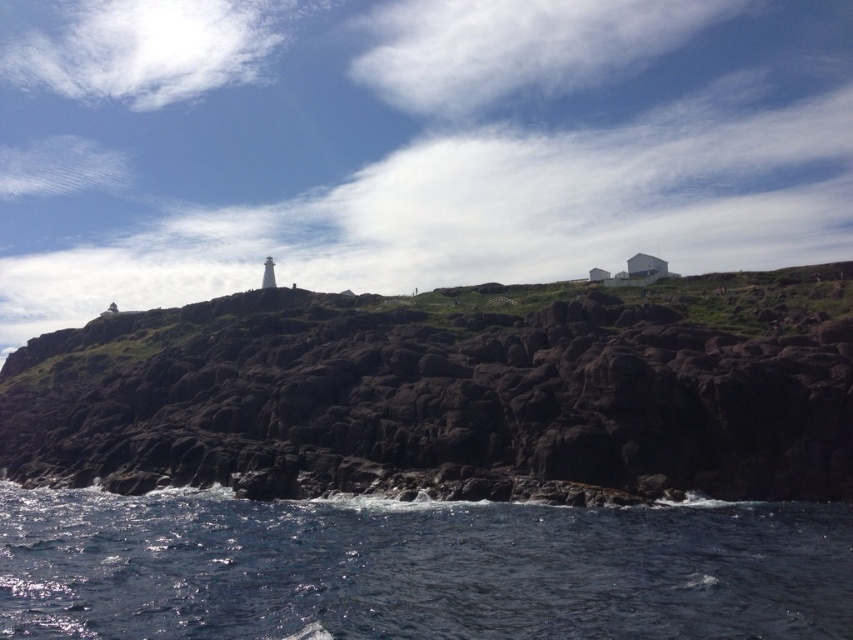
You are a geologist studying the coastal formations in this image. You need to locate the dark brown rocky cliff at center for your analysis. According to the coordinates provided, where exactly is it positioned?

The dark brown rocky cliff at center is located at point (433, 401).

Based on the photo, you are a photographer standing at the base of the dark brown rocky cliff at center. You want to capture a wide shot of the entire cliff in one frame. Based on the scene description, do you think you can step back far enough to fit the entire cliff into your camera frame without moving the camera position? Explain your reasoning using the provided information.

The dark brown rocky cliff at center is 210.23 feet away from the camera. Since the photographer is already at the base of the cliff, stepping back 210.23 feet would place them far enough to potentially capture the entire cliff in one frame, assuming the camera has a wide enough lens. However, the actual feasibility depends on the camera equipment and lens angle, but the distance suggests it might be possible.

You are a hiker standing at the base of the cliffs in the coastal landscape. You spot two points marked in the image. Which point, point (540, 433) or point (241, 500), is closer to you?

Point (540, 433) is closer to the viewer than point (241, 500).